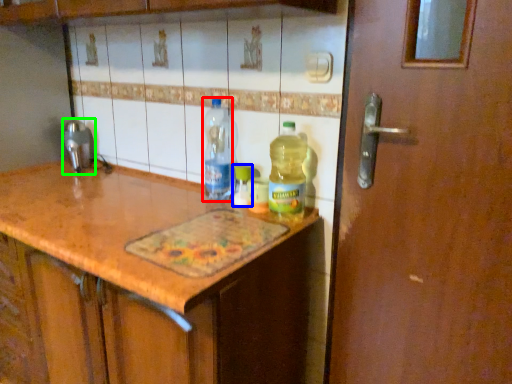
Question: Which object is the closest to the bottle (highlighted by a red box)? Choose among these: bottle (highlighted by a blue box) or faucet (highlighted by a green box).

Choices:
 (A) bottle
 (B) faucet

Answer: (A)